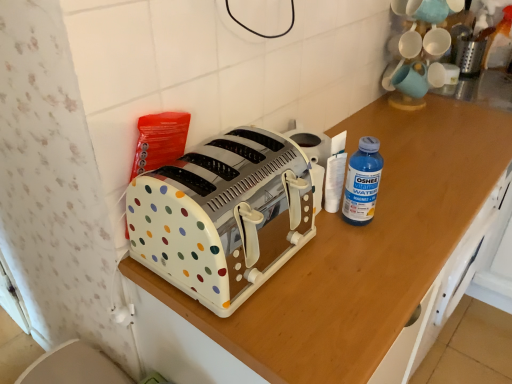
I want to click on vacant area that is in front of blue plastic bottle at right, so click(364, 268).